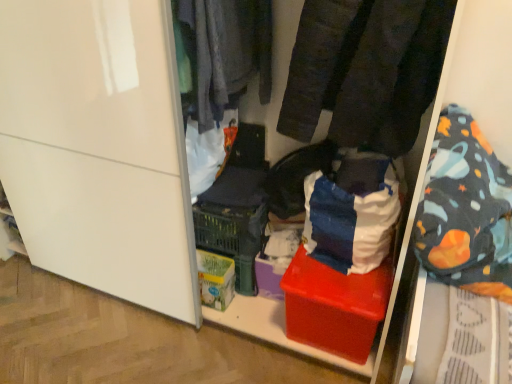
Question: Would you consider red plastic box at center to be distant from dark gray fabric at upper center, the first clothing in the left-to-right sequence?

Choices:
 (A) yes
 (B) no

Answer: (B)

Question: Is red plastic box at center looking in the opposite direction of dark gray fabric at upper center, which appears as the 2th clothing when viewed from the right?

Choices:
 (A) no
 (B) yes

Answer: (A)

Question: Is the depth of red plastic box at center less than that of dark gray fabric at upper center, the first clothing in the left-to-right sequence?

Choices:
 (A) no
 (B) yes

Answer: (A)

Question: Is red plastic box at center at the left side of dark gray fabric at upper center, which appears as the 2th clothing when viewed from the right?

Choices:
 (A) no
 (B) yes

Answer: (A)

Question: Does red plastic box at center appear on the right side of dark gray fabric at upper center, the first clothing in the left-to-right sequence?

Choices:
 (A) no
 (B) yes

Answer: (B)

Question: Is red plastic box at center further to the viewer compared to dark gray fabric at upper center, which appears as the 2th clothing when viewed from the right?

Choices:
 (A) no
 (B) yes

Answer: (B)

Question: From the image's perspective, is red plastic box at center located beneath green cardboard box at center?

Choices:
 (A) no
 (B) yes

Answer: (A)

Question: Does red plastic box at center come behind green cardboard box at center?

Choices:
 (A) yes
 (B) no

Answer: (B)

Question: Is green cardboard box at center a part of red plastic box at center?

Choices:
 (A) yes
 (B) no

Answer: (B)

Question: Is red plastic box at center smaller than green cardboard box at center?

Choices:
 (A) no
 (B) yes

Answer: (A)

Question: Is red plastic box at center looking in the opposite direction of green cardboard box at center?

Choices:
 (A) yes
 (B) no

Answer: (B)

Question: From a real-world perspective, is red plastic box at center located beneath green cardboard box at center?

Choices:
 (A) yes
 (B) no

Answer: (B)

Question: Is velvet-like black pants at center, the 1th clothing viewed from the right, positioned beyond the bounds of dark gray fabric at upper center, which appears as the 2th clothing when viewed from the right?

Choices:
 (A) yes
 (B) no

Answer: (A)